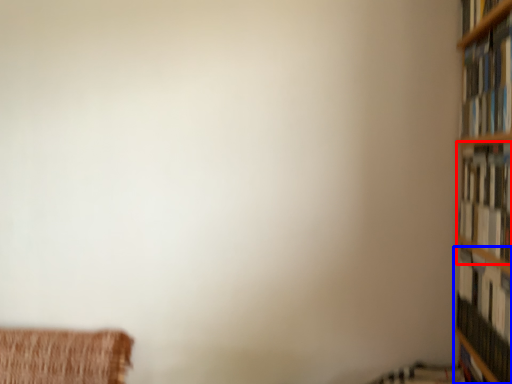
Question: Which object is further to the camera taking this photo, book (highlighted by a red box) or book (highlighted by a blue box)?

Choices:
 (A) book
 (B) book

Answer: (B)